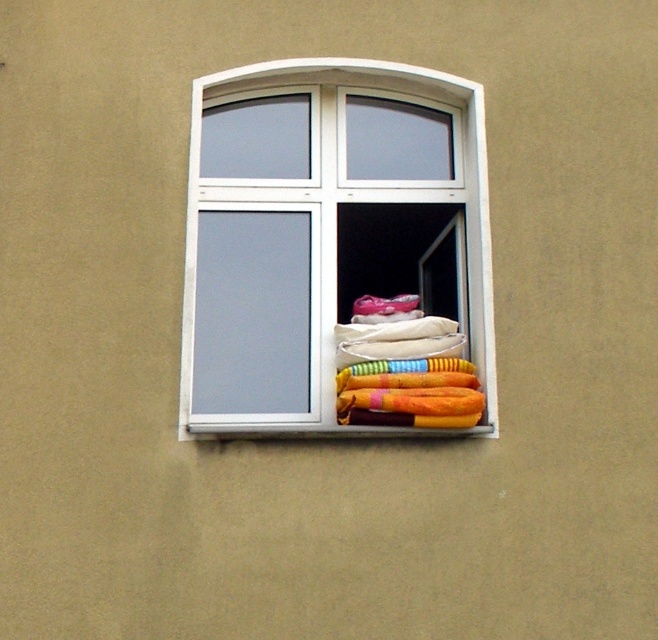
Looking at this image, you are standing in a room and see the white plastic window at center and the multicolored fabric at center. Which object is located to the right of the other?

The white plastic window at center is positioned on the left side of multicolored fabric at center, so the multicolored fabric at center is to the right of the white plastic window at center.

You are trying to hang a new curtain rod that requires at least 1.2 meters of vertical space. Given the white plastic window at center and the multicolored fabric at center, which object provides enough vertical space for the curtain rod?

The white plastic window at center has a greater height compared to the multicolored fabric at center, so it would provide enough vertical space for the curtain rod requiring at least 1.2 meters.

You are standing in front of the window with clothes stacked inside. There is a point marked at coordinates (x=311, y=227). What object is located at that point?

The point at coordinates (x=311, y=227) corresponds to the white plastic window at center.